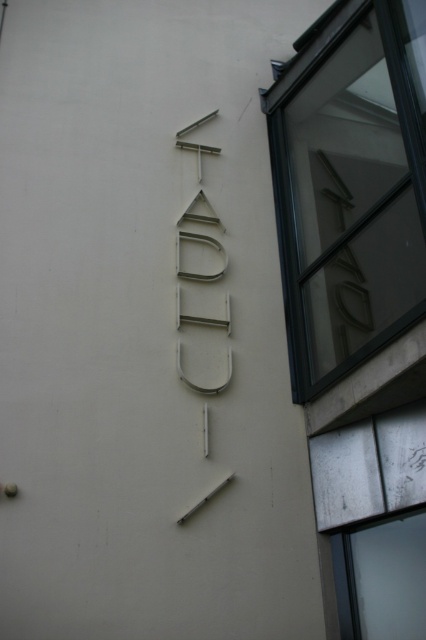
Does black glass window at upper right have a greater height compared to metallic silver sign at center?

Correct, black glass window at upper right is much taller as metallic silver sign at center.

Can you confirm if black glass window at upper right is positioned above metallic silver sign at center?

Yes, black glass window at upper right is above metallic silver sign at center.

Does point (319, 204) come behind point (199, 360)?

Yes, it is behind point (199, 360).

Find the location of a particular element. Image resolution: width=426 pixels, height=640 pixels. black glass window at upper right is located at coordinates (347, 192).